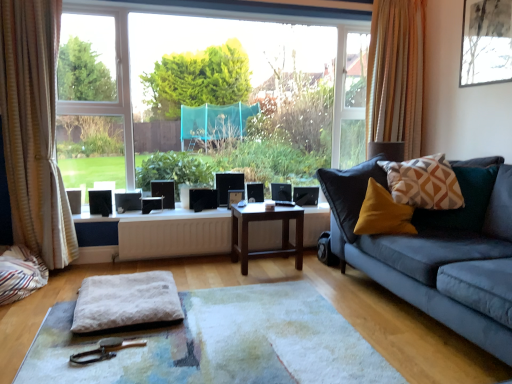
Locate an element on the screen. The height and width of the screenshot is (384, 512). matte black picture frame at upper right, positioned as the first picture frame in front-to-back order is located at coordinates (486, 42).

Locate an element on the screen. The width and height of the screenshot is (512, 384). footrest below the matte black picture frame at upper right, which is the 2th picture frame in bottom-to-top order (from a real-world perspective) is located at coordinates (126, 301).

From the image's perspective, is matte black picture frame at upper right, which is the 2th picture frame in bottom-to-top order, beneath white fluffy footrest at center?

No, from the image's perspective, matte black picture frame at upper right, which is the 2th picture frame in bottom-to-top order, is not beneath white fluffy footrest at center.

Is matte black picture frame at upper right, acting as the 2th picture frame starting from the back, positioned with its back to white fluffy footrest at center?

No.

Between white soft cushion at center and geometric-patterned fabric pillow at right, which one has larger size?

white soft cushion at center.

Considering their positions, is white soft cushion at center located in front of or behind geometric-patterned fabric pillow at right?

Visually, white soft cushion at center is located in front of geometric-patterned fabric pillow at right.

Locate an element on the screen. throw pillow above the white soft cushion at center (from a real-world perspective) is located at coordinates (424, 183).

Can you confirm if white fluffy footrest at center is thinner than matte black picture frame at upper right, acting as the 2th picture frame starting from the back?

No, white fluffy footrest at center is not thinner than matte black picture frame at upper right, acting as the 2th picture frame starting from the back.

Can you tell me how much white fluffy footrest at center and matte black picture frame at upper right, the first picture frame positioned from the right, differ in facing direction?

white fluffy footrest at center and matte black picture frame at upper right, the first picture frame positioned from the right, are facing 92.2 degrees away from each other.

Is white fluffy footrest at center closer to the viewer compared to matte black picture frame at upper right, which is the 2th picture frame in bottom-to-top order?

Yes, white fluffy footrest at center is closer to the camera.

I want to click on the footrest located in front of the matte black picture frame at upper right, acting as the second picture frame starting from the left, so click(126, 301).

Considering the positions of objects transparent glass window at center and brown wooden table at center in the image provided, who is more to the right, transparent glass window at center or brown wooden table at center?

brown wooden table at center.

Does transparent glass window at center contain brown wooden table at center?

Actually, brown wooden table at center is outside transparent glass window at center.

Locate an element on the screen. The width and height of the screenshot is (512, 384). table behind the transparent glass window at center is located at coordinates (266, 220).

Is transparent glass window at center wider or thinner than brown wooden table at center?

In the image, transparent glass window at center appears to be more narrow than brown wooden table at center.

The width and height of the screenshot is (512, 384). I want to click on flat below the geometric-patterned fabric pillow at right (from the image's perspective), so click(219, 343).

From the image's perspective, relative to white soft cushion at center, is geometric-patterned fabric pillow at right above or below?

Based on their image positions, geometric-patterned fabric pillow at right is located above white soft cushion at center.

In the scene shown: Considering the positions of objects geometric-patterned fabric pillow at right and white soft cushion at center in the image provided, who is behind, geometric-patterned fabric pillow at right or white soft cushion at center?

geometric-patterned fabric pillow at right is more distant.

From a real-world perspective, is geometric-patterned fabric pillow at right positioned over white soft cushion at center based on gravity?

Yes.

Identify the location of the 2nd picture frame above the white matte radiator at center (from the image's perspective). Image resolution: width=512 pixels, height=384 pixels. (486, 42).

Is white matte radiator at center oriented towards matte black picture frame at upper right, acting as the second picture frame starting from the left?

No, white matte radiator at center does not turn towards matte black picture frame at upper right, acting as the second picture frame starting from the left.

From the image's perspective, does white matte radiator at center appear higher than matte black picture frame at upper right, which ranks as the first picture frame in top-to-bottom order?

Incorrect, from the image's perspective, white matte radiator at center is lower than matte black picture frame at upper right, which ranks as the first picture frame in top-to-bottom order.

Measure the distance between white matte radiator at center and matte black picture frame at upper right, acting as the 2th picture frame starting from the back.

A distance of 7.70 feet exists between white matte radiator at center and matte black picture frame at upper right, acting as the 2th picture frame starting from the back.

Looking at this image, from the image's perspective, between brown wooden table at center and white matte radiator at center, which one is located above?

brown wooden table at center.

Considering the points (273, 256) and (195, 249), which point is behind, point (273, 256) or point (195, 249)?

The point (273, 256) is more distant.

Is brown wooden table at center oriented away from white matte radiator at center?

No.

At what (x,y) coordinates should I click in order to perform the action: click on radiator that appears below the brown wooden table at center (from the image's perspective). Please return your answer as a coordinate pair (x, y). The height and width of the screenshot is (384, 512). Looking at the image, I should click on (173, 237).

Where is `picture frame that is the 2nd object located above the white fluffy footrest at center (from the image's perspective)`? picture frame that is the 2nd object located above the white fluffy footrest at center (from the image's perspective) is located at coordinates (486, 42).

Locate an element on the screen. The image size is (512, 384). throw pillow behind the white soft cushion at center is located at coordinates (424, 183).

Which object lies nearer to the anchor point white soft cushion at center, white matte radiator at center or transparent glass window at center?

Among the two, white matte radiator at center is located nearer to white soft cushion at center.

Based on their spatial positions, is transparent glass window at center or brown wooden table at center further from white soft cushion at center?

transparent glass window at center lies further to white soft cushion at center than the other object.

Which object lies nearer to the anchor point white striped curtain at left, which appears as the 1th curtain when viewed from the left, white matte radiator at center or matte black picture frame at upper right, positioned as the first picture frame in front-to-back order?

Among the two, white matte radiator at center is located nearer to white striped curtain at left, which appears as the 1th curtain when viewed from the left.

Estimate the real-world distances between objects in this image. Which object is further from brown wooden table at center, transparent glass window at center or matte black picture frame at center, the 2th picture frame when ordered from top to bottom?

transparent glass window at center is positioned further to the anchor brown wooden table at center.

Considering their positions, is white fluffy footrest at center positioned further to beige textured curtain at right, which ranks as the 2th curtain in front-to-back order, than brown wooden table at center?

white fluffy footrest at center is further to beige textured curtain at right, which ranks as the 2th curtain in front-to-back order.

Which object lies further to the anchor point white striped curtain at left, which appears as the 1th curtain when viewed from the left, white soft cushion at center or white matte radiator at center?

Based on the image, white soft cushion at center appears to be further to white striped curtain at left, which appears as the 1th curtain when viewed from the left.

From the image, which object appears to be nearer to white matte radiator at center, matte black picture frame at center, which is the second picture frame from right to left, or geometric-patterned fabric pillow at right?

Among the two, matte black picture frame at center, which is the second picture frame from right to left, is located nearer to white matte radiator at center.

Estimate the real-world distances between objects in this image. Which object is further from transparent glass window at center, white fluffy footrest at center or geometric-patterned fabric pillow at right?

white fluffy footrest at center lies further to transparent glass window at center than the other object.

Find the location of a particular element. The height and width of the screenshot is (384, 512). table between white matte radiator at center and matte black picture frame at upper right, which ranks as the first picture frame in top-to-bottom order, from left to right is located at coordinates (266, 220).

Where is `throw pillow located between white striped curtain at left, acting as the second curtain starting from the back, and beige textured curtain at right, which is the first curtain in right-to-left order, in the left-right direction`? throw pillow located between white striped curtain at left, acting as the second curtain starting from the back, and beige textured curtain at right, which is the first curtain in right-to-left order, in the left-right direction is located at coordinates (424, 183).

Where is `table between matte black picture frame at center, the 2th picture frame when ordered from front to back, and matte black picture frame at upper right, acting as the second picture frame starting from the left, from left to right`? Image resolution: width=512 pixels, height=384 pixels. table between matte black picture frame at center, the 2th picture frame when ordered from front to back, and matte black picture frame at upper right, acting as the second picture frame starting from the left, from left to right is located at coordinates (266, 220).

The width and height of the screenshot is (512, 384). What are the coordinates of `radiator between white soft cushion at center and beige textured curtain at right, which is the first curtain in right-to-left order, from front to back` in the screenshot? It's located at [173, 237].